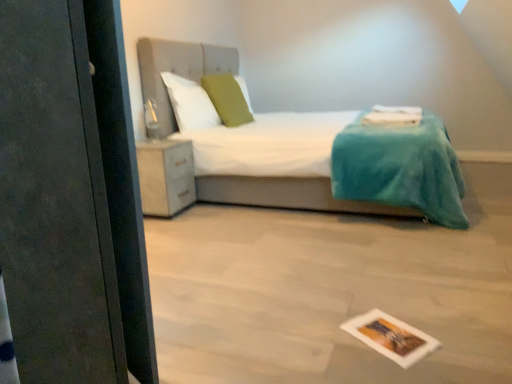
Image resolution: width=512 pixels, height=384 pixels. Find the location of `free point behind printed paper postcard at lower center`. free point behind printed paper postcard at lower center is located at coordinates click(371, 304).